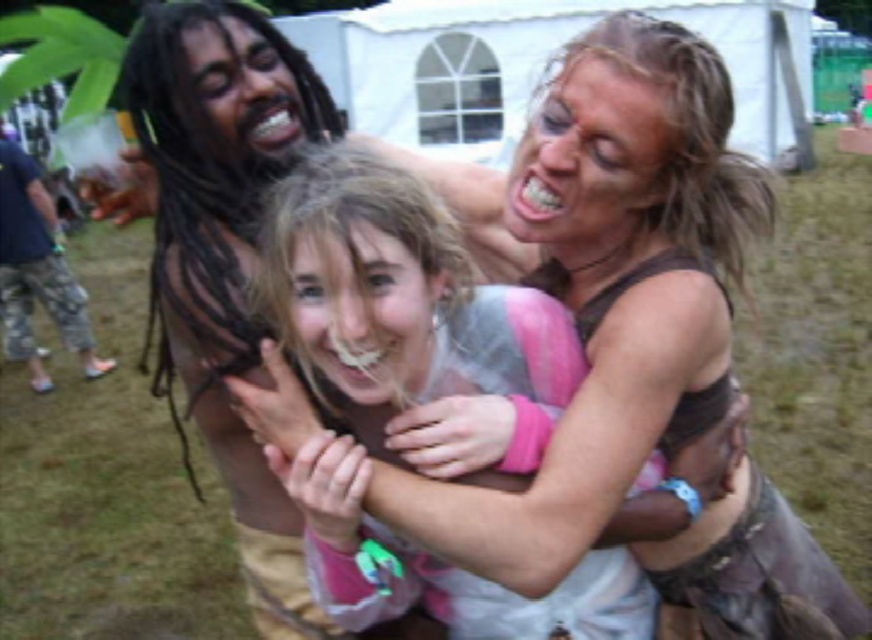
Question: Does pink fabric at center appear over smooth skin face at center?

Choices:
 (A) yes
 (B) no

Answer: (B)

Question: Among these objects, which one is nearest to the camera?

Choices:
 (A) blonde hair at upper right
 (B) dark brown hair at upper left
 (C) smooth skin face at center

Answer: (C)

Question: Which of the following is the farthest from the observer?

Choices:
 (A) (334, 368)
 (B) (264, 52)
 (C) (624, 129)
 (D) (353, 360)

Answer: (B)

Question: Does blonde hair at upper right lie in front of dark brown hair at upper left?

Choices:
 (A) yes
 (B) no

Answer: (A)

Question: From the image, what is the correct spatial relationship of smooth skin face at center in relation to dark brown hair at upper left?

Choices:
 (A) right
 (B) left

Answer: (A)

Question: Among these objects, which one is nearest to the camera?

Choices:
 (A) smooth skin face at center
 (B) dark brown hair at upper left

Answer: (A)